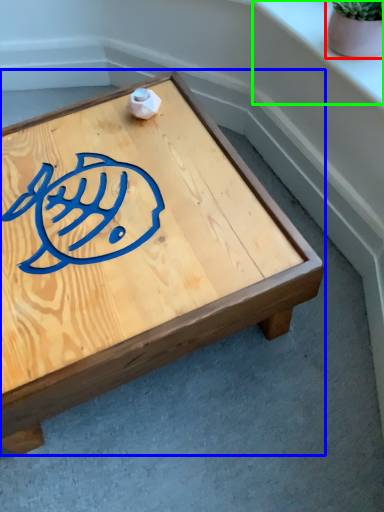
Question: Considering the real-world distances, which object is farthest from flowerpot (highlighted by a red box)? coffee table (highlighted by a blue box) or window sill (highlighted by a green box)?

Choices:
 (A) coffee table
 (B) window sill

Answer: (A)